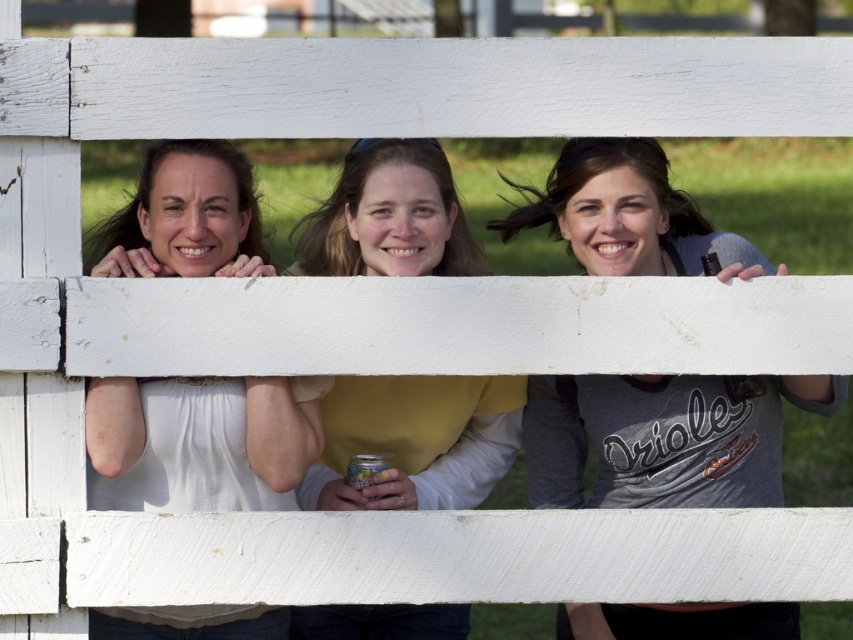
You are a photographer taking a picture of two women leaning on a white wooden fence. You notice the white matte shirt at upper left and the yellow matte shirt at center. Which shirt is covering part of the other?

The white matte shirt at upper left is positioned over the yellow matte shirt at center, so it is covering part of it.

You are a photographer trying to capture a clear shot of the gray matte shirt at center and the yellow matte shirt at center. Which shirt will appear more in front in the photo?

The gray matte shirt at center will appear more in front in the photo because it is positioned over the yellow matte shirt at center.